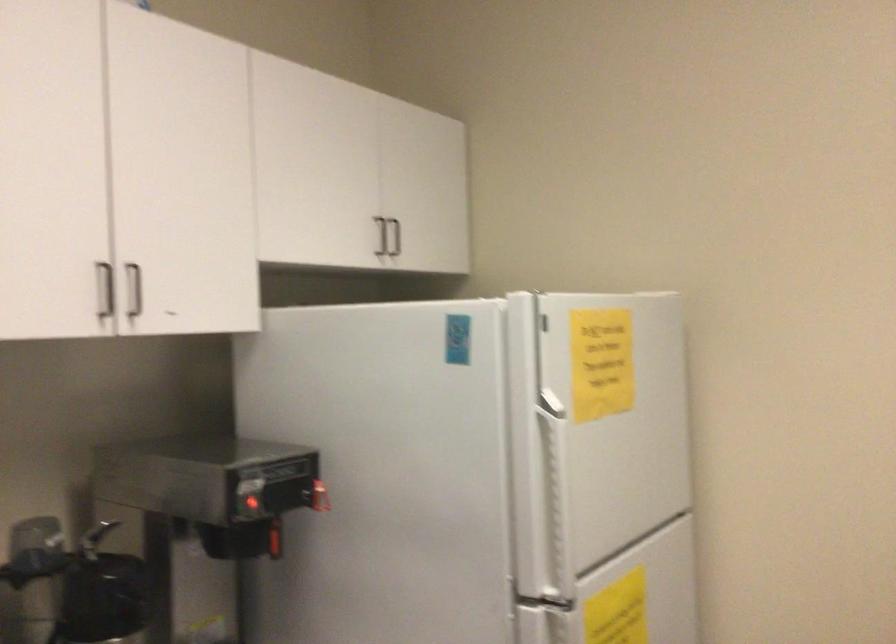
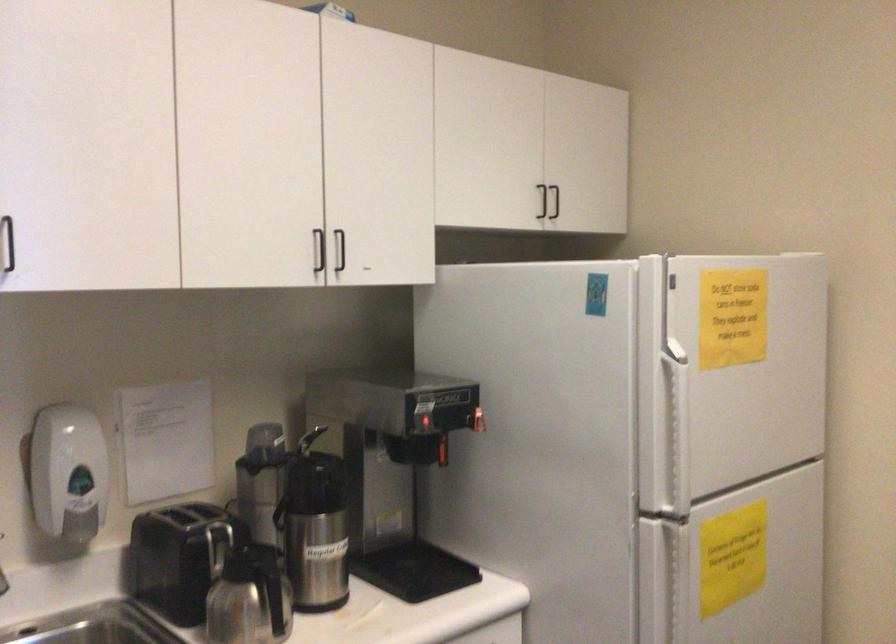
Find the pixel in the second image that matches the point at 391,238 in the first image.

(555, 201)